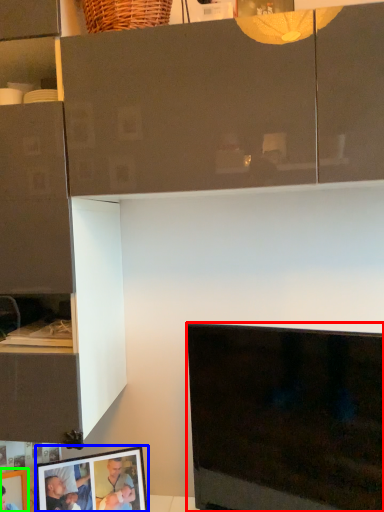
Question: Which object is positioned closest to television (highlighted by a red box)? Select from picture frame (highlighted by a blue box) and picture frame (highlighted by a green box).

Choices:
 (A) picture frame
 (B) picture frame

Answer: (A)